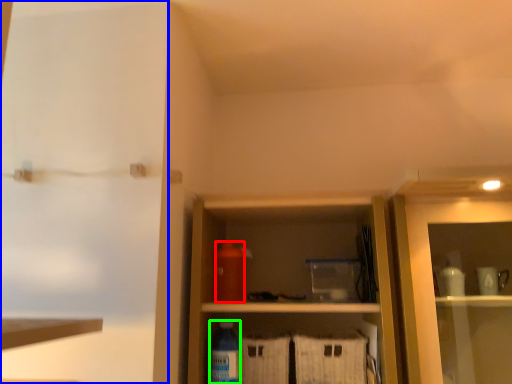
Question: Which object is positioned closest to bottle (highlighted by a red box)? Select from screen door (highlighted by a blue box) and bottle (highlighted by a green box).

Choices:
 (A) screen door
 (B) bottle

Answer: (B)